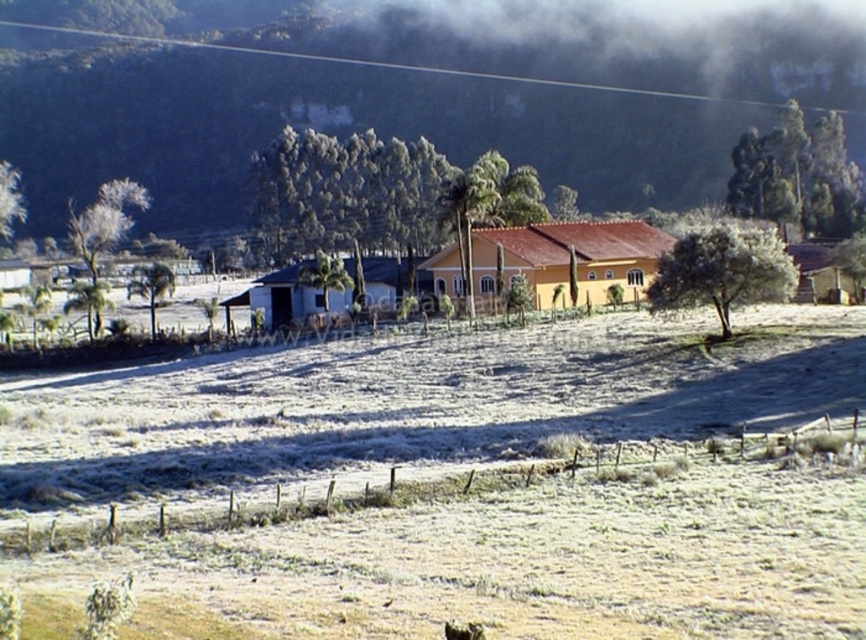
Can you confirm if green matte hillside at center is bigger than yellow matte house at center?

Yes.

Who is more distant from viewer, (229, 154) or (619, 221)?

The point (229, 154) is more distant.

Find the location of a particular element. The height and width of the screenshot is (640, 866). green matte hillside at center is located at coordinates (410, 93).

Between white frosty field at center and white matte hut at center, which one appears on the left side from the viewer's perspective?

white matte hut at center

Where is `white frosty field at center`? The width and height of the screenshot is (866, 640). white frosty field at center is located at coordinates (463, 481).

Locate an element on the screen. This screenshot has height=640, width=866. white frosty field at center is located at coordinates (463, 481).

Is white frosty field at center positioned in front of green matte hillside at center?

Yes, white frosty field at center is closer to the viewer.

Identify the location of white frosty field at center. (463, 481).

What are the coordinates of `white frosty field at center` in the screenshot? It's located at (463, 481).